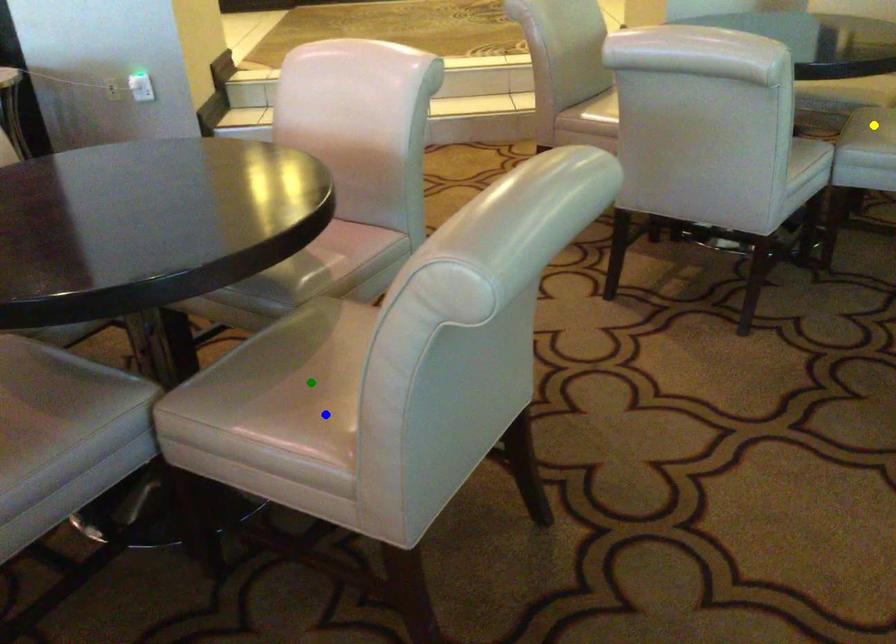
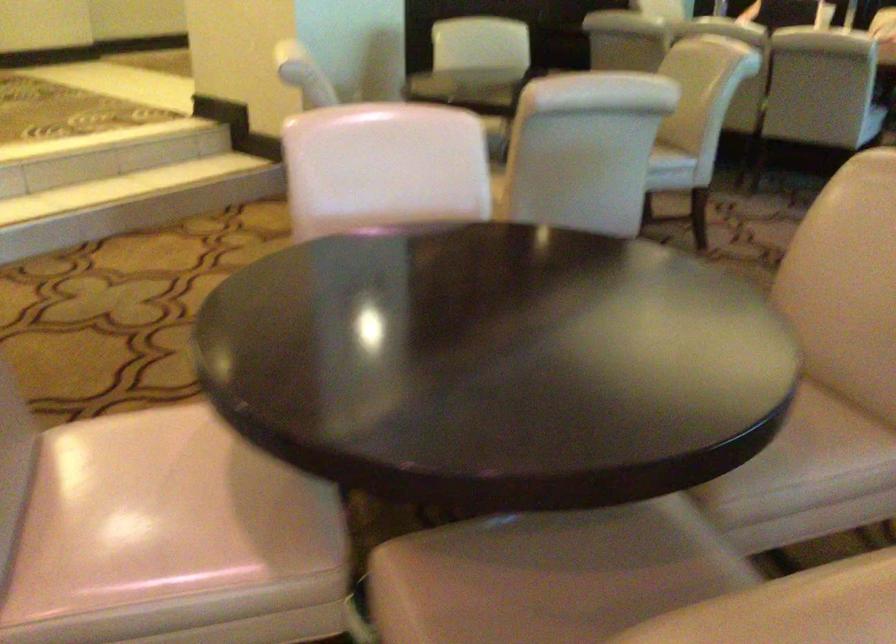
I am providing you with two images of the same scene from different viewpoints. Three points are marked in image1. Which point corresponds to a part or object that is occluded in image2?In image1, three points are marked. Which of them correspond to a part or object that is occluded in image2?Among the three points shown in image1, which one corresponds to a part or object that is no longer visible due to occlusion in image2?

green point, yellow point